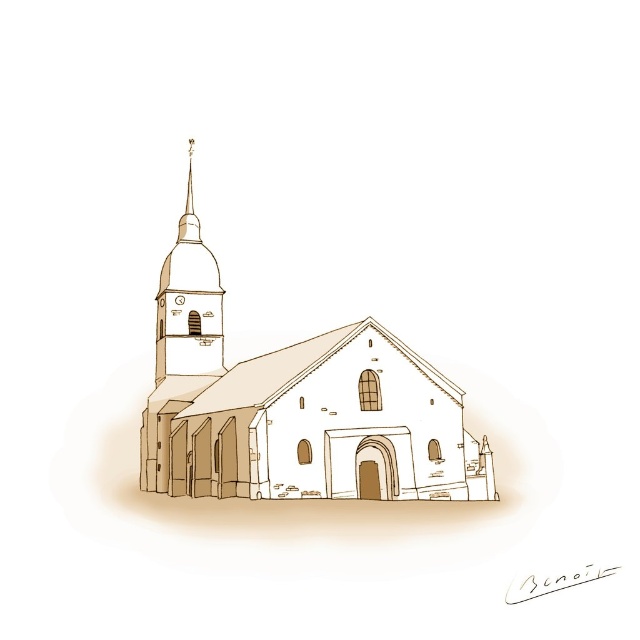
Does brown textured church at center appear over smooth beige spire at upper left?

No.

Is brown textured church at center wider than smooth beige spire at upper left?

Yes.

The height and width of the screenshot is (640, 640). What do you see at coordinates (296, 406) in the screenshot?
I see `brown textured church at center` at bounding box center [296, 406].

Where is `brown textured church at center`? The image size is (640, 640). brown textured church at center is located at coordinates (296, 406).